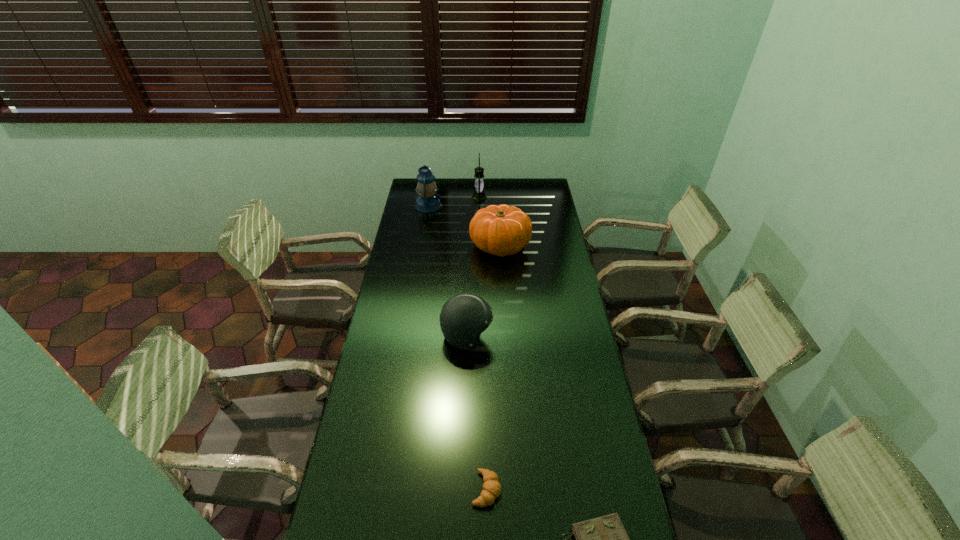
Where is `free space that satisfies the following two spatial constraints: 1. on the side where the right lantern emits light; 2. on the left side of the fourth nearest object`? This screenshot has height=540, width=960. free space that satisfies the following two spatial constraints: 1. on the side where the right lantern emits light; 2. on the left side of the fourth nearest object is located at coordinates (479, 246).